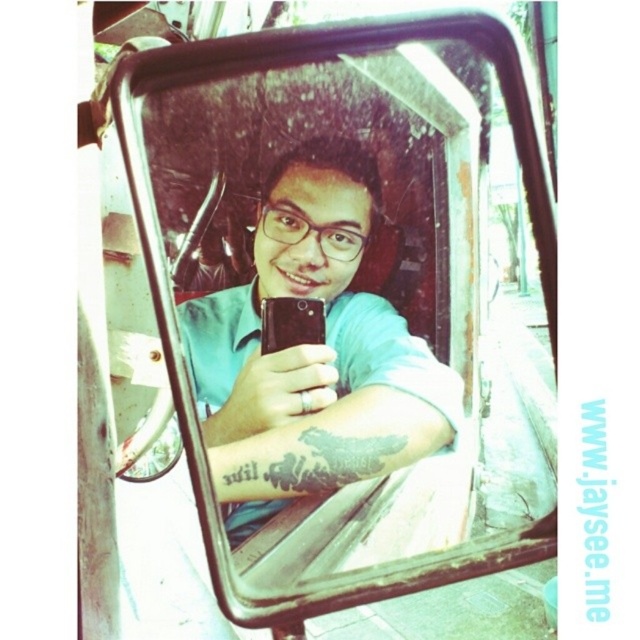
Question: Is clear glass mirror at center positioned at the back of matte black phone at center?

Choices:
 (A) no
 (B) yes

Answer: (A)

Question: Can you confirm if clear glass mirror at center is smaller than matte black phone at center?

Choices:
 (A) yes
 (B) no

Answer: (B)

Question: Which point is farther to the camera?

Choices:
 (A) (349, 560)
 (B) (301, 438)

Answer: (A)

Question: Which object is closer to the camera taking this photo?

Choices:
 (A) matte black phone at center
 (B) clear glass mirror at center

Answer: (B)

Question: From the image, what is the correct spatial relationship of clear glass mirror at center in relation to matte black phone at center?

Choices:
 (A) above
 (B) below

Answer: (B)